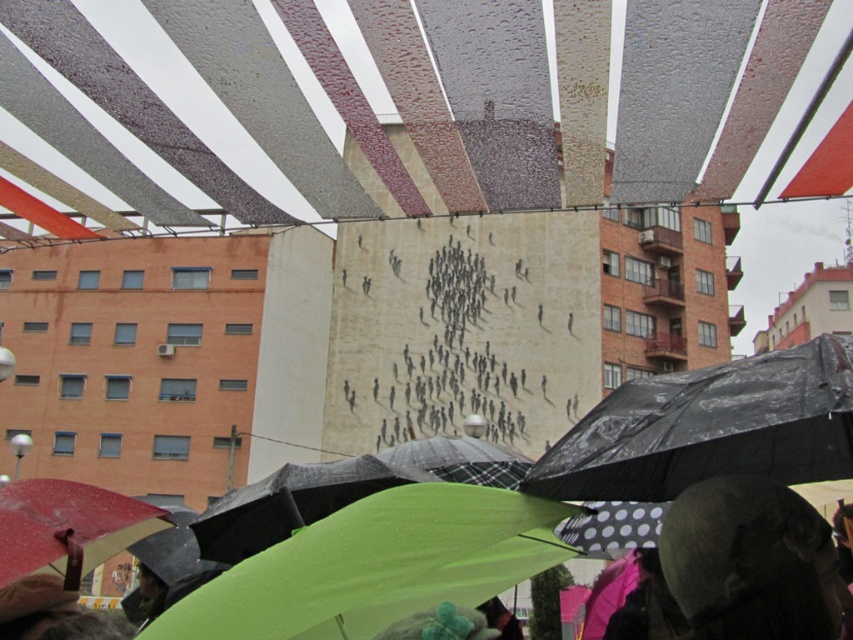
Who is positioned more to the left, dark gray wool hat at lower right or textured fabric canopy at center?

textured fabric canopy at center

Can you confirm if dark gray wool hat at lower right is thinner than textured fabric canopy at center?

Yes, dark gray wool hat at lower right is thinner than textured fabric canopy at center.

Locate an element on the screen. dark gray wool hat at lower right is located at coordinates (750, 561).

Can you confirm if black plastic umbrella at center is positioned above textured fabric canopy at center?

No.

Which of these two, black plastic umbrella at center or textured fabric canopy at center, stands shorter?

black plastic umbrella at center

Between point (751, 394) and point (619, 120), which one is positioned in front?

Point (751, 394) is more forward.

Where is `black plastic umbrella at center`? This screenshot has width=853, height=640. black plastic umbrella at center is located at coordinates (711, 428).

Can you confirm if green matte umbrella at lower center is smaller than black plastic umbrella at center?

Yes.

Does green matte umbrella at lower center come behind black plastic umbrella at center?

That is False.

Is point (548, 520) closer to viewer compared to point (813, 404)?

No, (548, 520) is behind (813, 404).

Where is `green matte umbrella at lower center`? Image resolution: width=853 pixels, height=640 pixels. green matte umbrella at lower center is located at coordinates (376, 564).